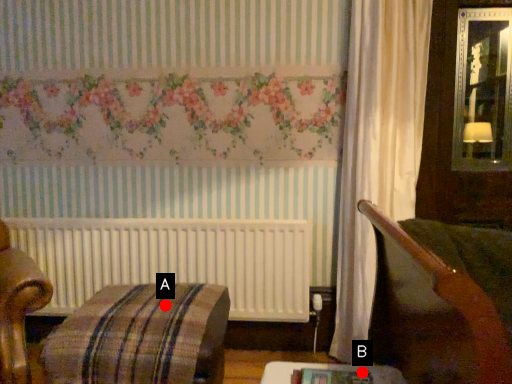
Question: Two points are circled on the image, labeled by A and B beside each circle. Among these points, which one is nearest to the camera?

Choices:
 (A) A is closer
 (B) B is closer

Answer: (B)